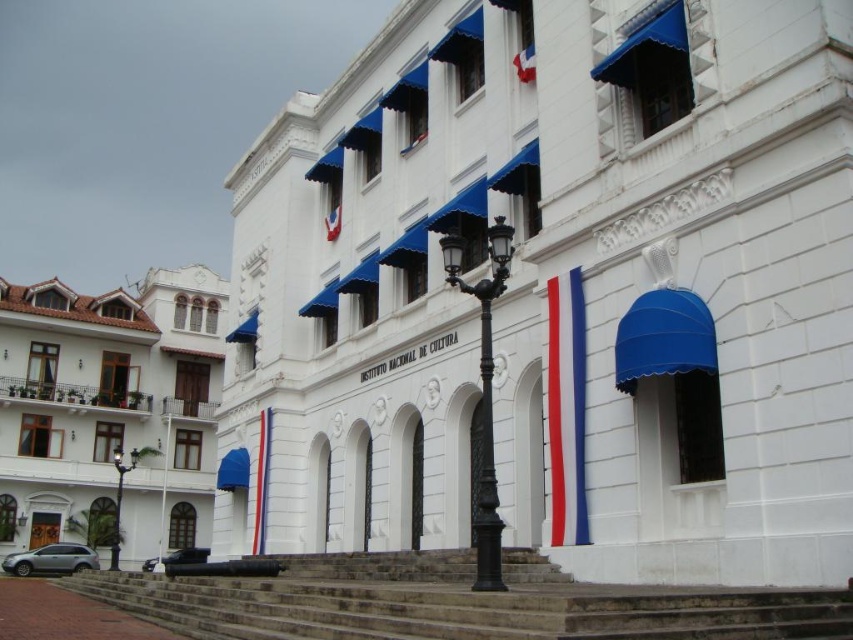
Who is more forward, (491, 449) or (262, 454)?

Point (491, 449) is more forward.

This screenshot has height=640, width=853. Describe the element at coordinates (486, 458) in the screenshot. I see `black wrought iron pole at center` at that location.

You are a GUI agent. You are given a task and a screenshot of the screen. Output one action in this format:
    pyautogui.click(x=<x>, y=<y>)
    Task: Click on the black wrought iron pole at center
    This screenshot has width=853, height=640.
    Given the screenshot: What is the action you would take?
    pyautogui.click(x=486, y=458)

Does point (24, 564) come behind point (148, 564)?

That is False.

Is silver metallic car at lower left above metallic silver car at lower left?

Yes, silver metallic car at lower left is above metallic silver car at lower left.

Who is more distant from viewer, (76, 554) or (170, 552)?

Point (170, 552)

Where is `silver metallic car at lower left`? This screenshot has width=853, height=640. silver metallic car at lower left is located at coordinates 50,560.

Between red/blue fabric flag at center and blue fabric flag at lower left, which one is positioned higher?

Positioned higher is red/blue fabric flag at center.

Which is in front, point (549, 340) or point (247, 476)?

Point (549, 340)

Identify the location of red/blue fabric flag at center. The image size is (853, 640). (566, 408).